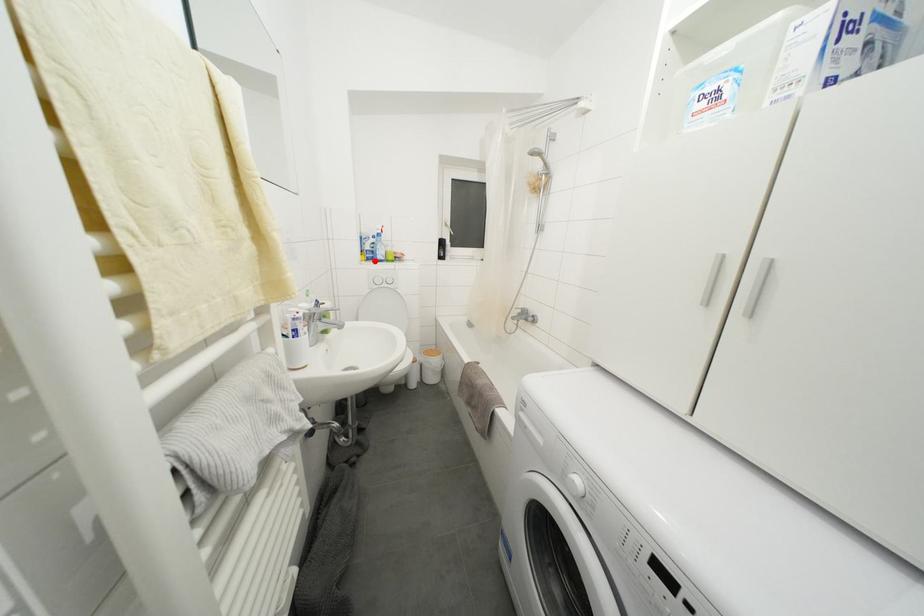
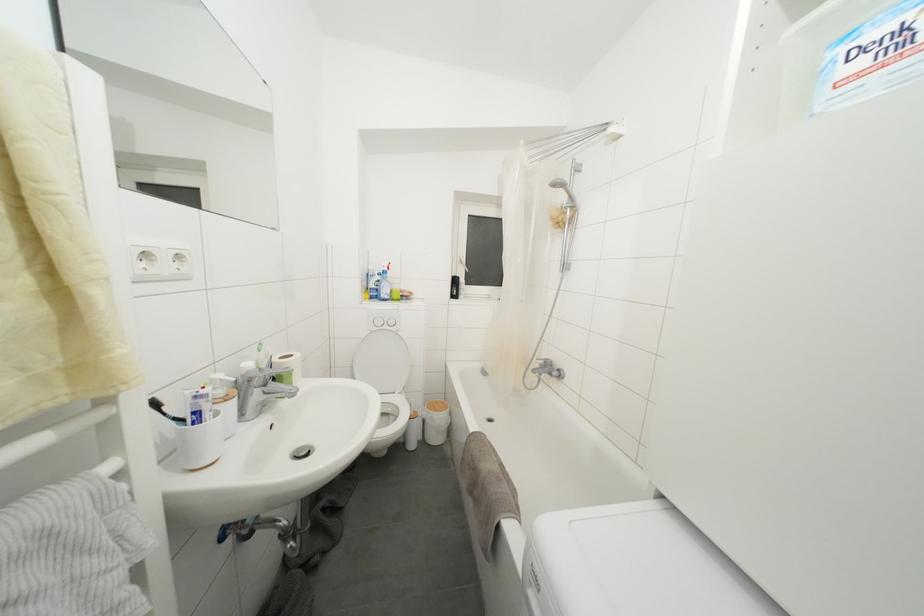
In the second image, find the point that corresponds to the highlighted location in the first image.

(379, 300)